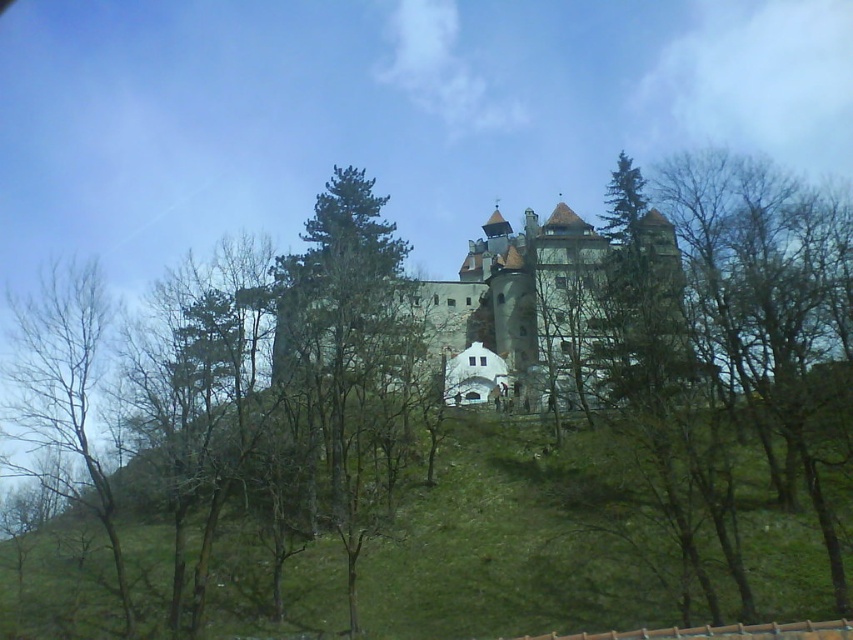
You are a tourist standing at the base of the hill looking towards Bran Castle. You notice the brown stone castle at center and the bare branches at left. Which object is positioned more to the east if the sun is setting in the west?

The bare branches at left are positioned more to the east because the brown stone castle at center is to the right of bare branches at left, and since the sun is setting in the west, the right side of the image faces west while the left side faces east.

You are a tourist visiting Bran Castle and want to take a photo that includes both the brown stone castle at center and the bare branches at left. Which object should you focus on first to ensure both are in frame?

The brown stone castle at center is much taller than the bare branches at left, so you should focus on the brown stone castle at center first to ensure both are in frame.